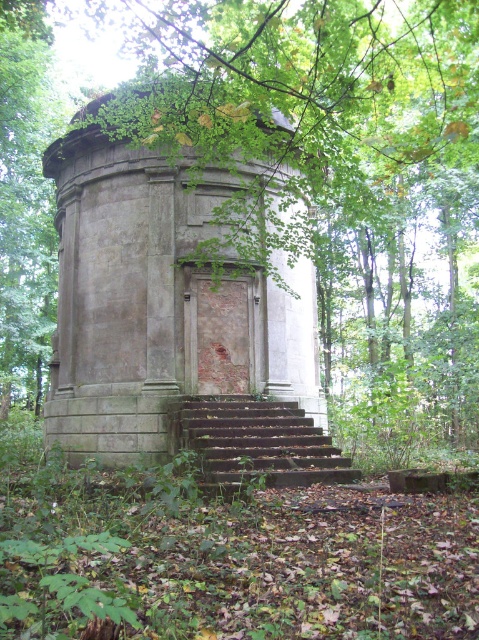
You are a hiker who wants to take a photo of the gray stone monument at center and the rusty metal stairs at center from a distance. Which object will appear larger in the photo?

The gray stone monument at center is taller than the rusty metal stairs at center, so it will appear larger in the photo.

You are a maintenance worker who needs to reach the gray stone monument at center from the rusty metal stairs at center. Given that your ladder is 5 feet long, can you safely reach the monument without needing to move the ladder?

The distance between the gray stone monument at center and the rusty metal stairs at center is 5.51 feet. Since the ladder is only 5 feet long, it is not long enough to cover the 5.51 feet gap. Therefore, you cannot safely reach the monument without moving the ladder.